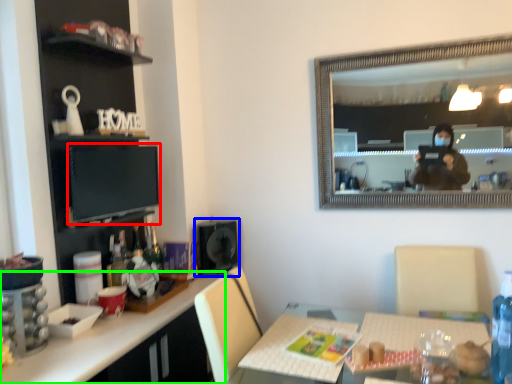
Question: Considering the real-world distances, which object is closest to computer monitor (highlighted by a red box)? speaker (highlighted by a blue box) or desk (highlighted by a green box).

Choices:
 (A) speaker
 (B) desk

Answer: (B)